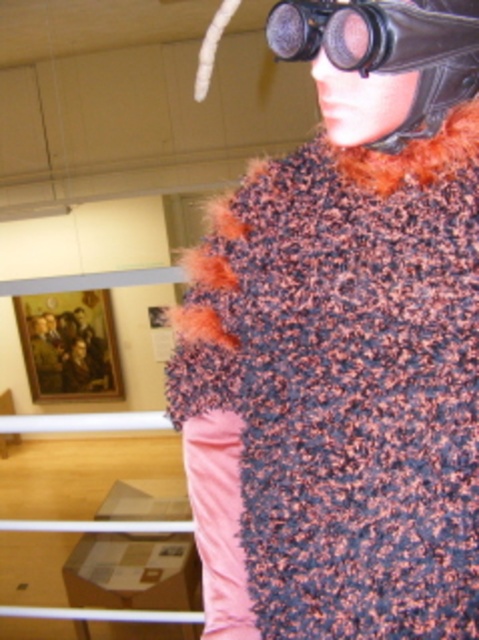
You are standing in front of the person in the image. You notice two points marked on their outfit. One is at coordinate point (218, 365) and the other is at point (376, 60). Which point is closer to you?

Point (218, 365) is closer to you because it is further to the viewer than point (376, 60).

You are standing in a museum and notice a person wearing a fuzzy multicolored scarf at upper center and black goggles with a strap around their head. If you want to take a photo of the scarf without including the goggles, where should you position yourself relative to the person?

The fuzzy multicolored scarf at upper center is located at point [343,344], so positioning yourself slightly below and to the side of the person would allow you to capture the scarf without the goggles obstructing the view.

You are standing in a museum and want to take a photo of the point at coordinates point (342, 488). If your camera has a focal length of 50mm and you are currently 1 meter away from the point, should you move closer or farther away to focus properly?

The point (342, 488) is 69.66 centimeters away from the camera. Since you are currently 1 meter away, you should move closer to 69.66 centimeters to focus properly.